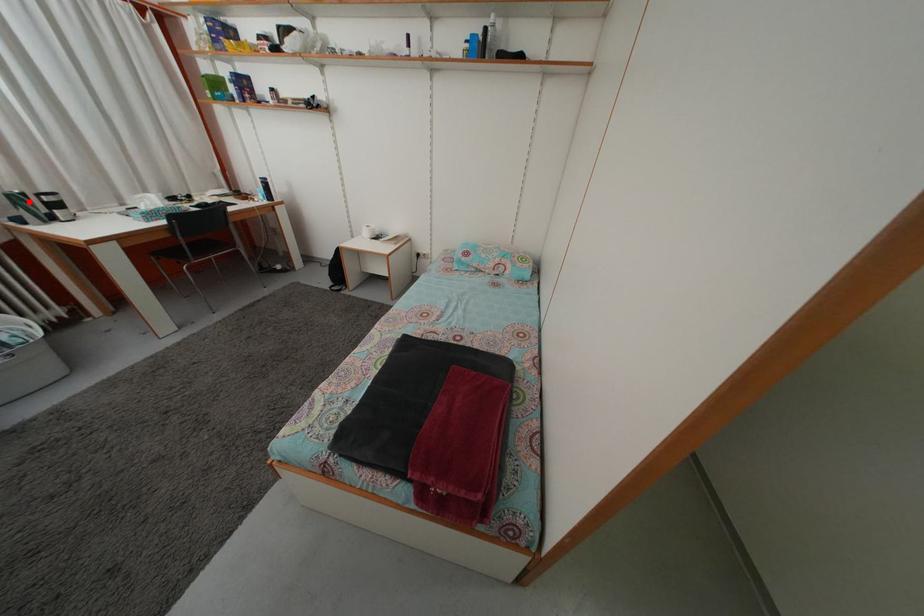
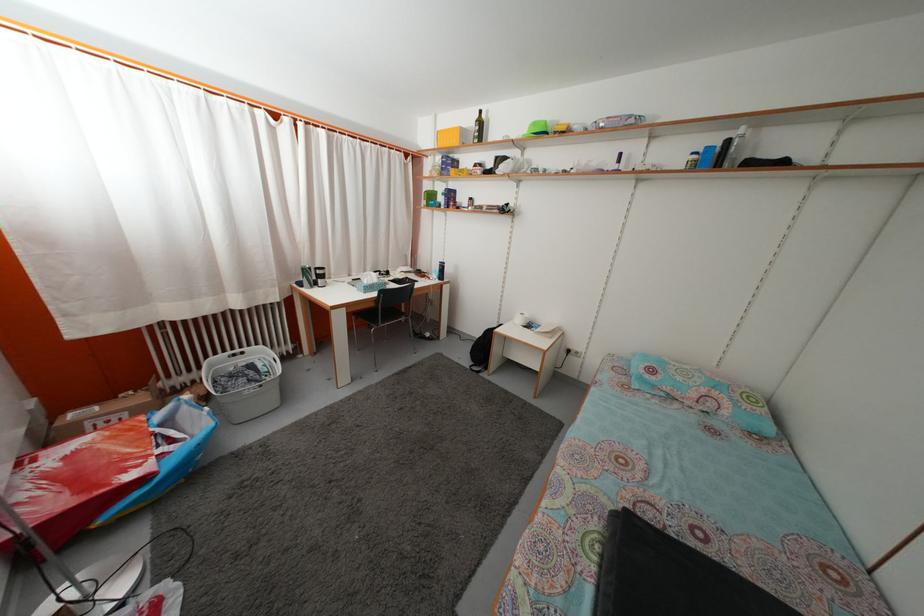
Question: I am providing you with two images of the same scene from different viewpoints. Image1 has a red point marked. In image2, the corresponding 3D location appears at what relative position? Reply with the corresponding letter.

Choices:
 (A) Closer
 (B) Farther

Answer: (A)